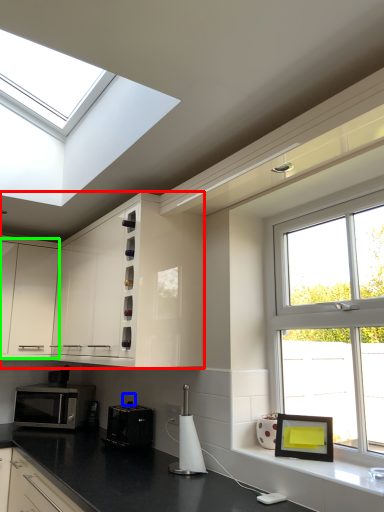
Question: Based on their relative distances, which object is farther from cabinetry (highlighted by a red box)? Choose from electric outlet (highlighted by a blue box) and cabinetry (highlighted by a green box).

Choices:
 (A) electric outlet
 (B) cabinetry

Answer: (A)